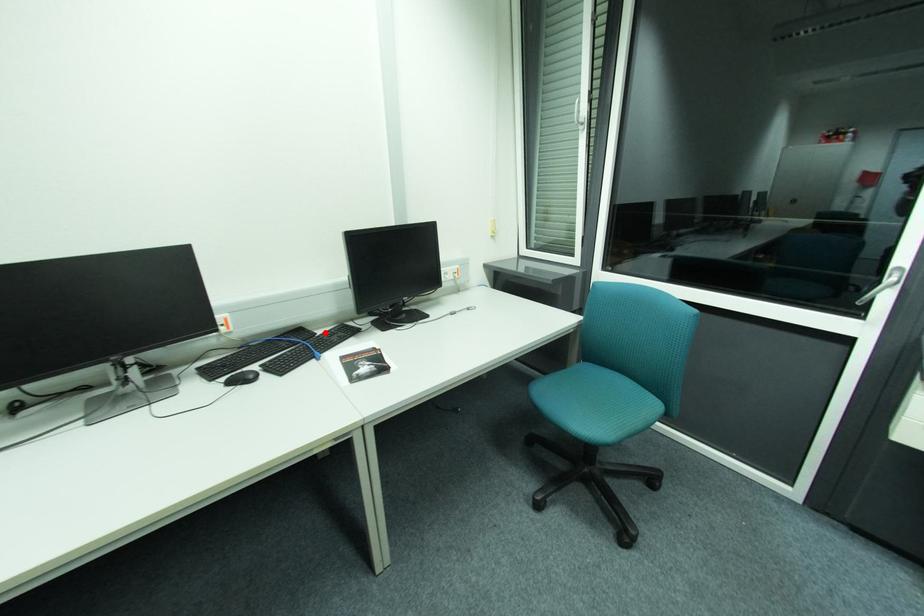
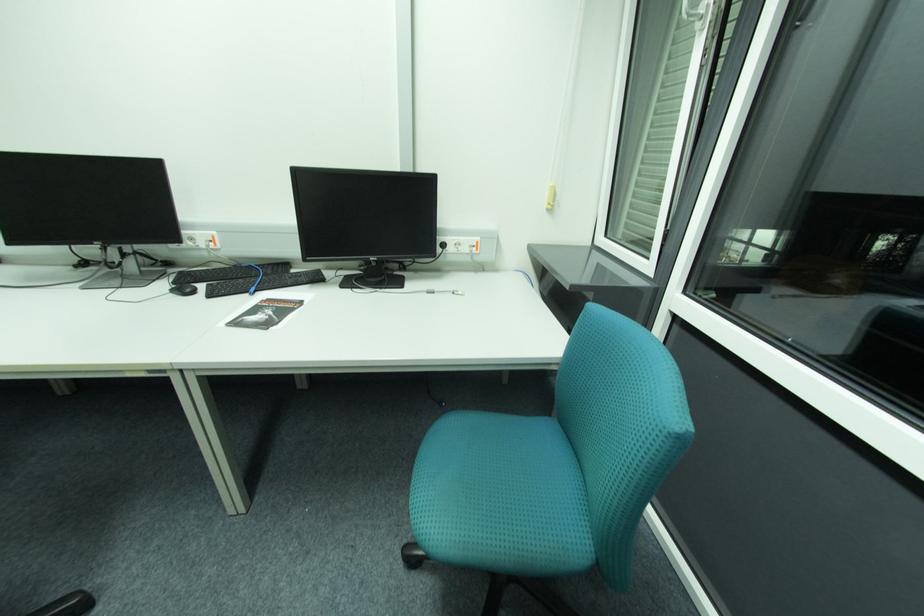
Locate, in the second image, the point that corresponds to the highlighted location in the first image.

(298, 272)